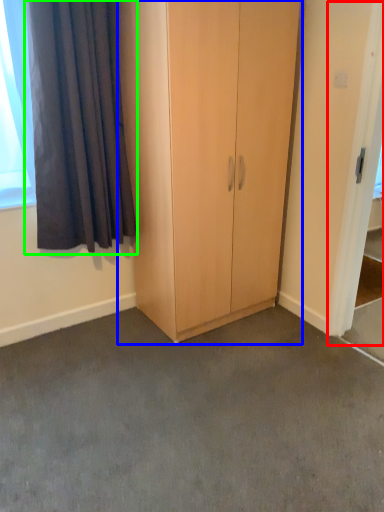
Question: Considering the real-world distances, which object is farthest from screen door (highlighted by a red box)? cupboard (highlighted by a blue box) or curtain (highlighted by a green box)?

Choices:
 (A) cupboard
 (B) curtain

Answer: (B)